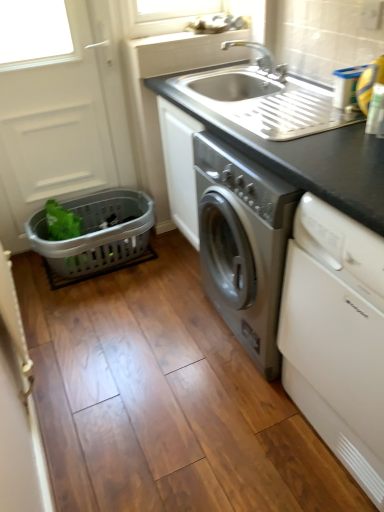
Locate an element on the screen. vacant space behind silver metallic faucet at upper center is located at coordinates (243, 73).